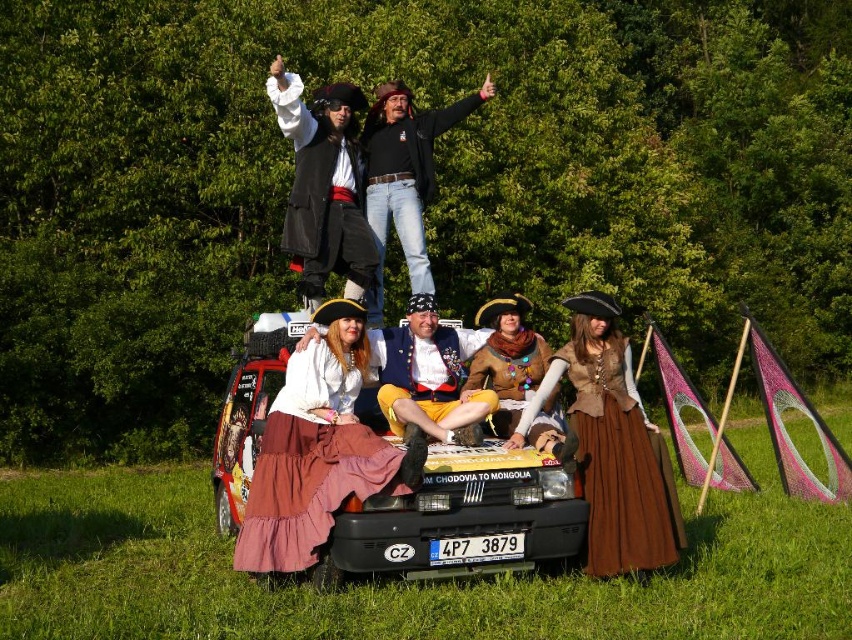
You are a photographer trying to capture a photo of the matte black car at center and the matte black coat at upper center. If the camera can only focus on objects within a 1.2 meter width, will both objects fit in the frame?

The matte black car at center might be wider than matte black coat at upper center. Since the camera can only focus on objects within a 1.2 meter width, it is uncertain if both objects will fit in the frame as the car could exceed the width limit.